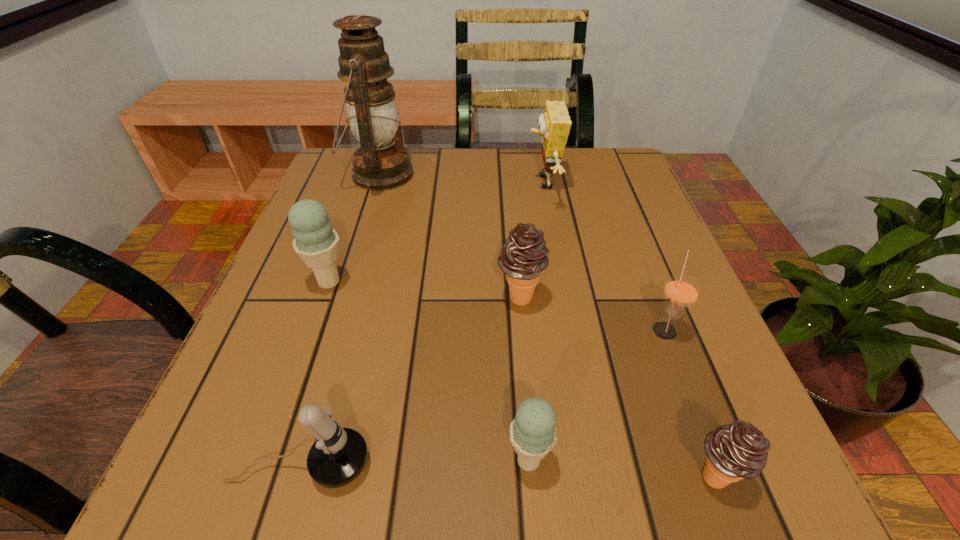
Where is `vacant space located on the back of the right blue ice cream`? This screenshot has height=540, width=960. vacant space located on the back of the right blue ice cream is located at coordinates (512, 251).

Identify the location of vacant space situated on the left of the nearer chocolate icecream. pyautogui.click(x=550, y=476).

Image resolution: width=960 pixels, height=540 pixels. I want to click on lantern that is at the far edge, so click(380, 164).

Identify the location of sponge at the far edge. The width and height of the screenshot is (960, 540). (554, 124).

Where is `microphone at the near edge`? The height and width of the screenshot is (540, 960). microphone at the near edge is located at coordinates (337, 457).

Identify the location of lantern situated at the left edge. (380, 164).

I want to click on ice cream located in the left edge section of the desktop, so click(317, 244).

The width and height of the screenshot is (960, 540). Find the location of `microphone that is at the left edge`. microphone that is at the left edge is located at coordinates (337, 457).

Locate an element on the screen. The width and height of the screenshot is (960, 540). straw that is positioned at the right edge is located at coordinates (681, 291).

Identify the location of icecream that is at the right edge. (736, 451).